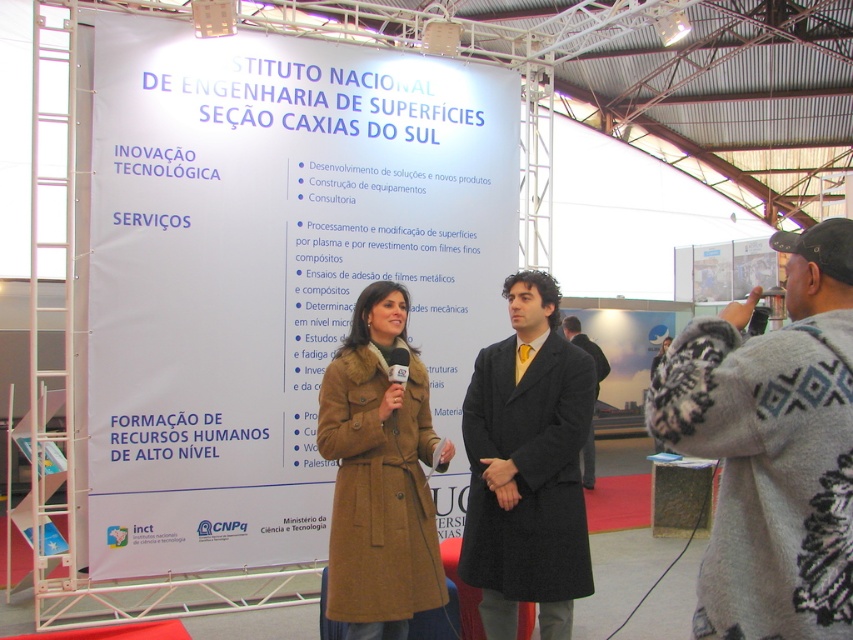
Question: Among these points, which one is farthest from the camera?

Choices:
 (A) (604, 358)
 (B) (741, 509)
 (C) (338, 435)
 (D) (543, 513)

Answer: (A)

Question: Does dark gray wool coat at center come behind dark gray coat at center?

Choices:
 (A) no
 (B) yes

Answer: (A)

Question: Which object appears closest to the camera in this image?

Choices:
 (A) brown wool coat at center
 (B) knitted gray sweater at right
 (C) dark gray coat at center

Answer: (B)

Question: Which object is farther from the camera taking this photo?

Choices:
 (A) brown wool coat at center
 (B) dark gray wool coat at center
 (C) dark gray coat at center

Answer: (C)

Question: Can you confirm if knitted gray sweater at right is positioned to the right of dark gray coat at center?

Choices:
 (A) yes
 (B) no

Answer: (B)

Question: Does dark gray wool coat at center appear on the left side of dark gray coat at center?

Choices:
 (A) no
 (B) yes

Answer: (B)